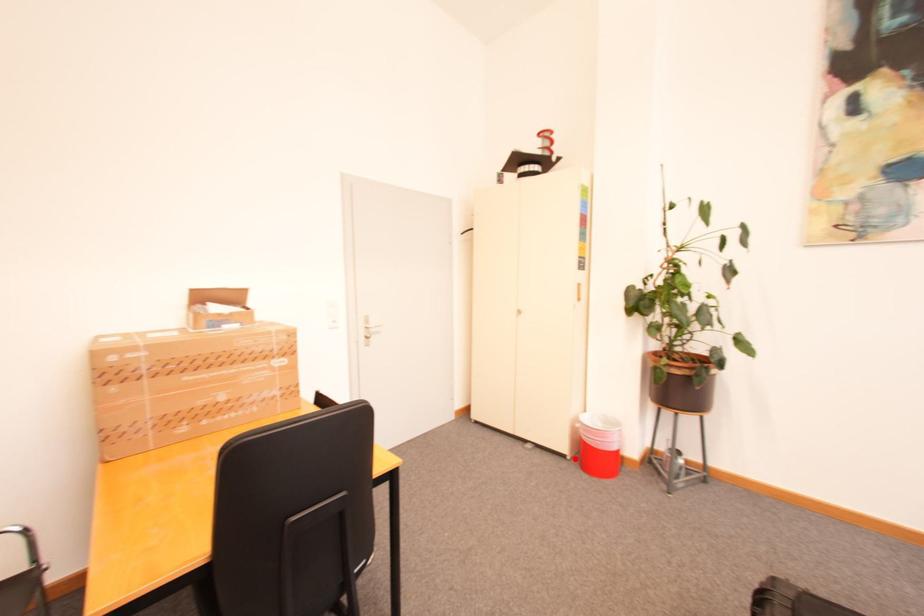
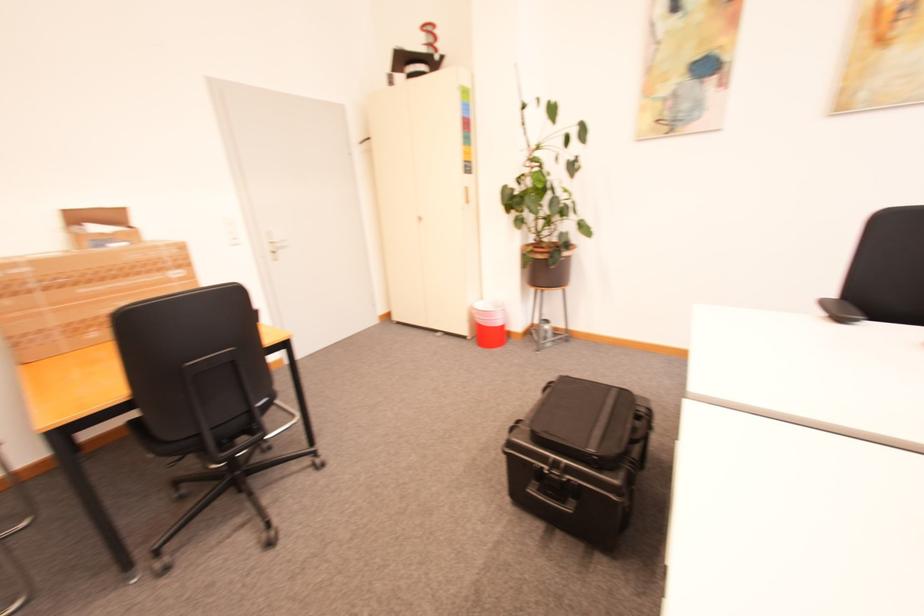
Question: I am providing you with two images of the same scene from different viewpoints. Image1 has a red point marked. In image2, the corresponding 3D location appears at what relative position? Reply with the corresponding letter.

Choices:
 (A) Closer
 (B) Farther

Answer: (A)